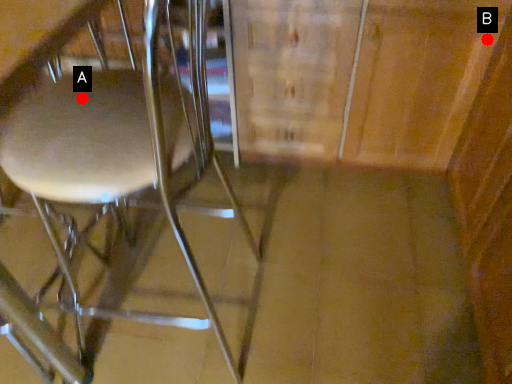
Question: Two points are circled on the image, labeled by A and B beside each circle. Which point appears closest to the camera in this image?

Choices:
 (A) A is closer
 (B) B is closer

Answer: (A)